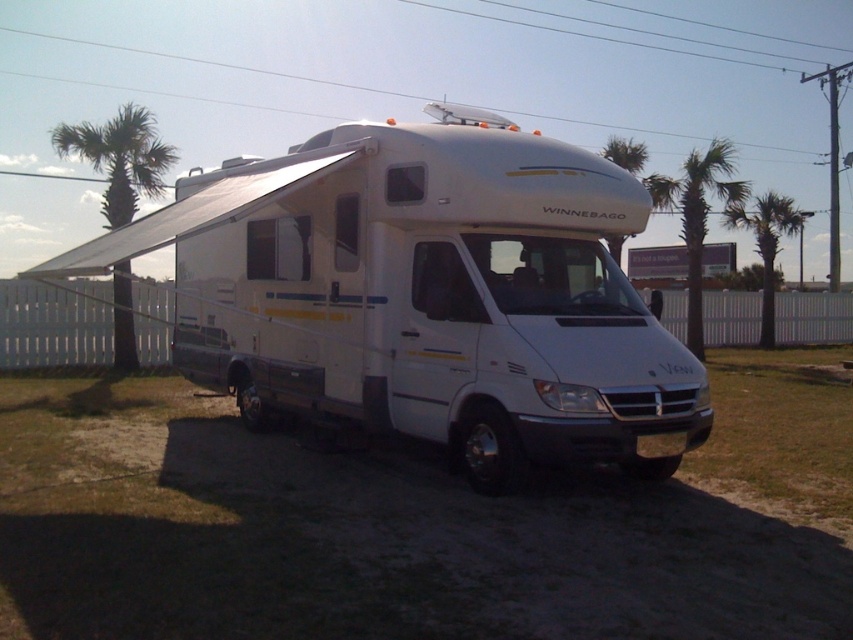
Question: Which point appears closest to the camera in this image?

Choices:
 (A) (102, 168)
 (B) (618, 156)

Answer: (A)

Question: Is green leafy palm tree at upper right to the left of green leafy palm tree at right from the viewer's perspective?

Choices:
 (A) no
 (B) yes

Answer: (B)

Question: Which point is farther to the camera?

Choices:
 (A) green leafy palm tree at upper center
 (B) white matte recreational vehicle at center
 (C) green leafy palm tree at left
 (D) green leafy palm tree at upper right

Answer: (D)

Question: Is white matte recreational vehicle at center bigger than green leafy palm tree at left?

Choices:
 (A) no
 (B) yes

Answer: (A)

Question: Is green leafy palm tree at left positioned before green leafy palm tree at upper center?

Choices:
 (A) no
 (B) yes

Answer: (B)

Question: Which object appears closest to the camera in this image?

Choices:
 (A) green leafy palm tree at right
 (B) green leafy palm tree at upper right
 (C) green leafy palm tree at left

Answer: (C)